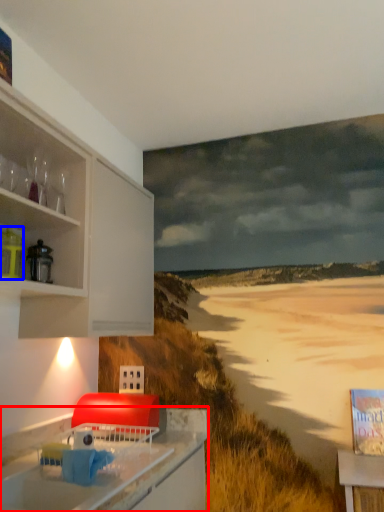
Question: Which of the following is the closest to the observer, countertop (highlighted by a red box) or appliance (highlighted by a blue box)?

Choices:
 (A) countertop
 (B) appliance

Answer: (A)